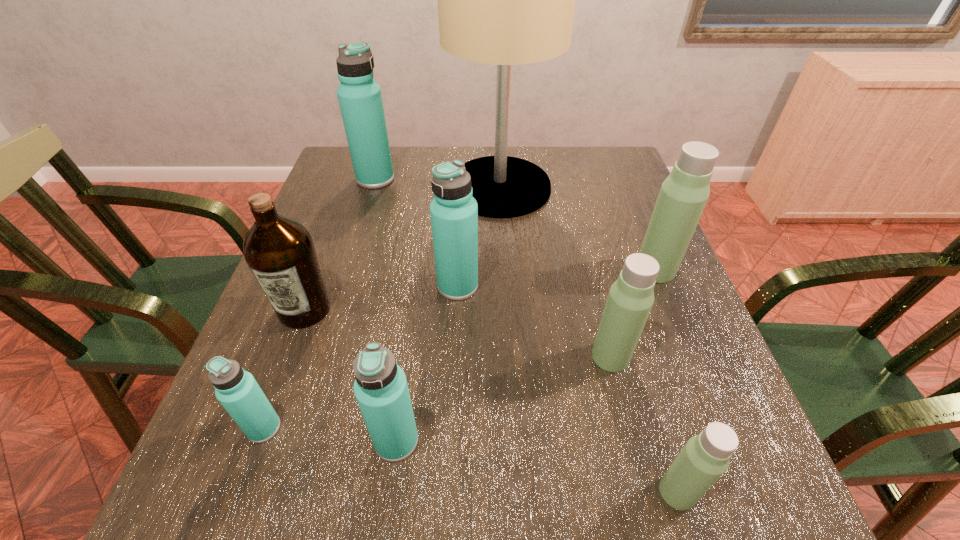
I want to click on free space that is in between the nearest light thermos bottle and the farthest thermos bottle, so click(x=526, y=335).

Image resolution: width=960 pixels, height=540 pixels. I want to click on vacant area that lies between the brown olive oil and the biggest light thermos bottle, so click(x=480, y=289).

The height and width of the screenshot is (540, 960). In order to click on free space between the brown olive oil and the nearest thermos bottle in this screenshot , I will do `click(491, 401)`.

This screenshot has width=960, height=540. I want to click on free space between the eighth shortest object and the second farthest light thermos bottle, so click(493, 268).

At what (x,y) coordinates should I click in order to perform the action: click on vacant space that is in between the nearest light thermos bottle and the rightmost aqua thermos bottle. Please return your answer as a coordinate pair (x, y). Looking at the image, I should click on (567, 389).

Image resolution: width=960 pixels, height=540 pixels. I want to click on object that is the third closest to the smallest aqua thermos bottle, so click(x=454, y=212).

Select which object is the fifth closest to the third nearest aqua thermos bottle. Please provide its 2D coordinates. Your answer should be formatted as a tuple, i.e. [(x, y)], where the tuple contains the x and y coordinates of a point satisfying the conditions above.

[(237, 390)]

Select which thermos bottle appears as the closest to the third smallest aqua thermos bottle. Please provide its 2D coordinates. Your answer should be formatted as a tuple, i.e. [(x, y)], where the tuple contains the x and y coordinates of a point satisfying the conditions above.

[(631, 297)]

In order to click on thermos bottle that is the closest to the smallest aqua thermos bottle in this screenshot , I will do `click(380, 387)`.

Locate an element on the screen. The image size is (960, 540). the third closest aqua thermos bottle to the tallest object is located at coordinates (380, 387).